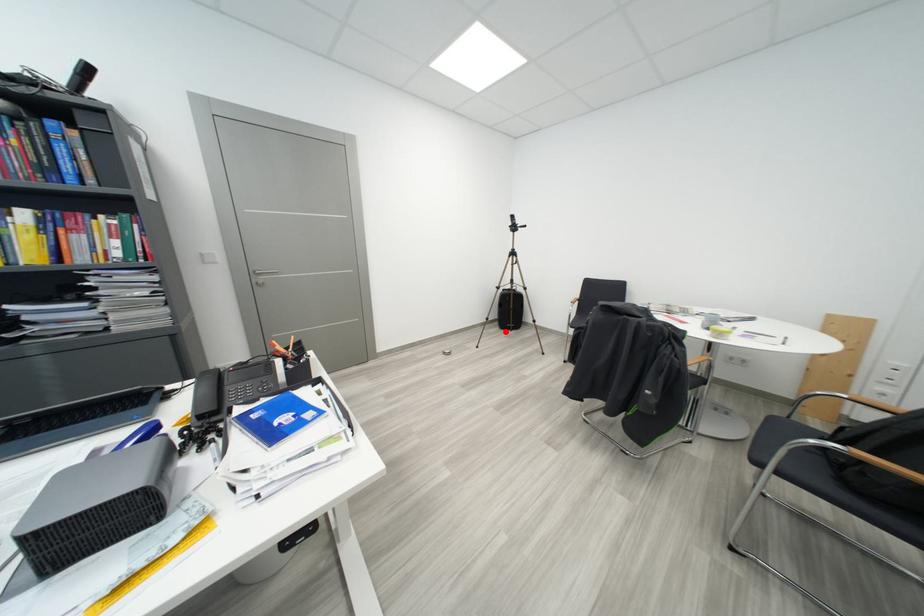
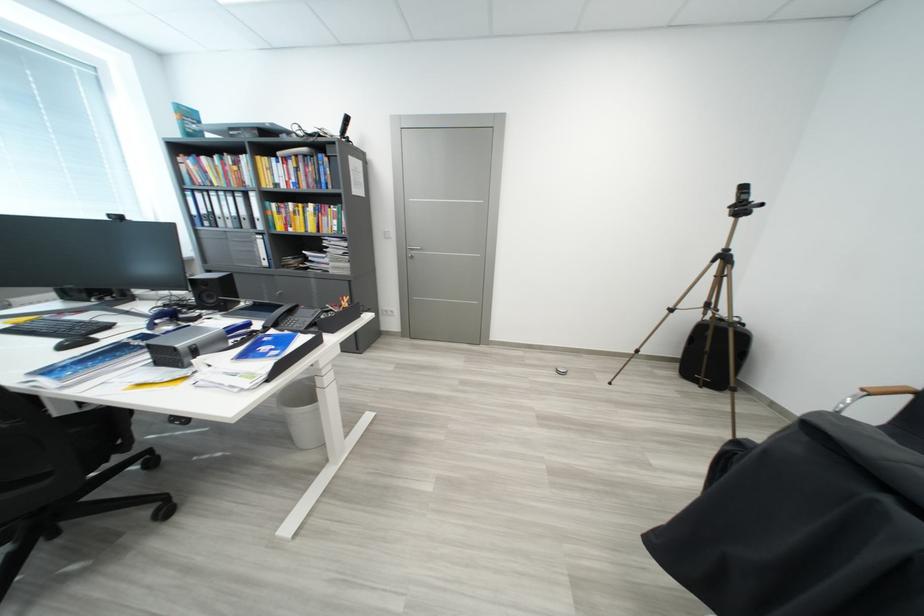
Question: A red point is marked in image1. In image2, is the corresponding 3D point closer to the camera or farther? Reply with the corresponding letter.

Choices:
 (A) The corresponding 3D point is closer.
 (B) The corresponding 3D point is farther.

Answer: (A)